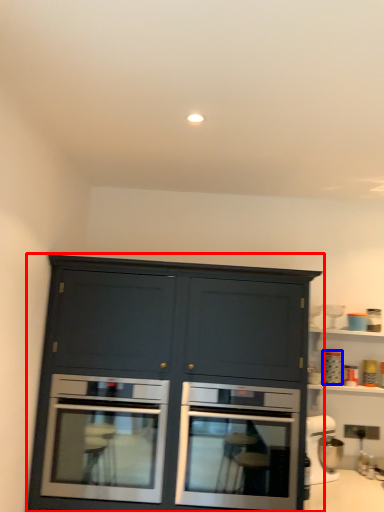
Question: Which object is further to the camera taking this photo, cabinetry (highlighted by a red box) or appliance (highlighted by a blue box)?

Choices:
 (A) cabinetry
 (B) appliance

Answer: (B)